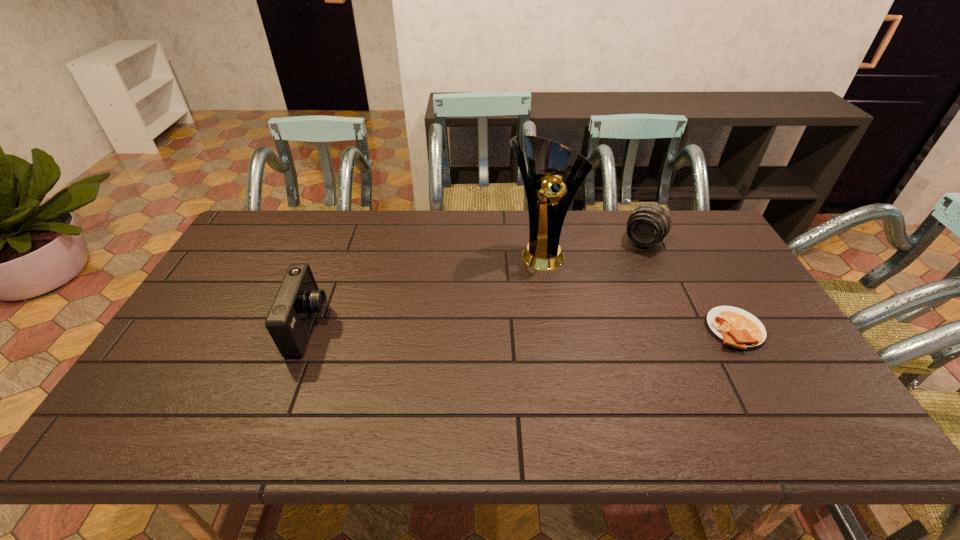
Where is `free spot on the desktop that is between the camera and the shortest object and is positioned at the front of the award, where the globe is visible`? free spot on the desktop that is between the camera and the shortest object and is positioned at the front of the award, where the globe is visible is located at coordinates (575, 329).

The height and width of the screenshot is (540, 960). What are the coordinates of `vacant space on the desktop that is between the leftmost object and the shortest object and is positioned at the front element of the telephoto lens` in the screenshot? It's located at (585, 329).